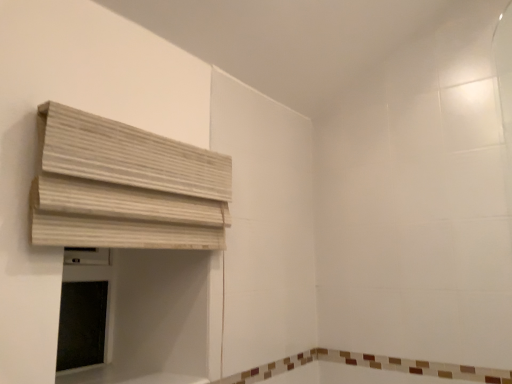
Question: Considering the relative sizes of brown tile bath at lower right and beige wood blinds at upper left in the image provided, is brown tile bath at lower right smaller than beige wood blinds at upper left?

Choices:
 (A) no
 (B) yes

Answer: (B)

Question: From a real-world perspective, is brown tile bath at lower right over beige wood blinds at upper left?

Choices:
 (A) no
 (B) yes

Answer: (A)

Question: Does brown tile bath at lower right have a larger size compared to beige wood blinds at upper left?

Choices:
 (A) no
 (B) yes

Answer: (A)

Question: Is brown tile bath at lower right to the left of beige wood blinds at upper left from the viewer's perspective?

Choices:
 (A) no
 (B) yes

Answer: (A)

Question: Is beige wood blinds at upper left at the back of brown tile bath at lower right?

Choices:
 (A) yes
 (B) no

Answer: (B)

Question: From the image's perspective, is brown tile bath at lower right on top of beige wood blinds at upper left?

Choices:
 (A) no
 (B) yes

Answer: (A)

Question: Does beige wood blinds at upper left have a greater height compared to brown tile bath at lower right?

Choices:
 (A) no
 (B) yes

Answer: (B)

Question: Could brown tile bath at lower right be considered to be inside beige wood blinds at upper left?

Choices:
 (A) yes
 (B) no

Answer: (B)

Question: Can you see beige wood blinds at upper left touching brown tile bath at lower right?

Choices:
 (A) no
 (B) yes

Answer: (A)

Question: From a real-world perspective, is beige wood blinds at upper left physically below brown tile bath at lower right?

Choices:
 (A) yes
 (B) no

Answer: (B)

Question: Does beige wood blinds at upper left turn towards brown tile bath at lower right?

Choices:
 (A) yes
 (B) no

Answer: (B)

Question: Does beige wood blinds at upper left have a lesser height compared to brown tile bath at lower right?

Choices:
 (A) no
 (B) yes

Answer: (A)

Question: Considering the positions of point (444, 372) and point (152, 221), is point (444, 372) closer or farther from the camera than point (152, 221)?

Choices:
 (A) closer
 (B) farther

Answer: (B)